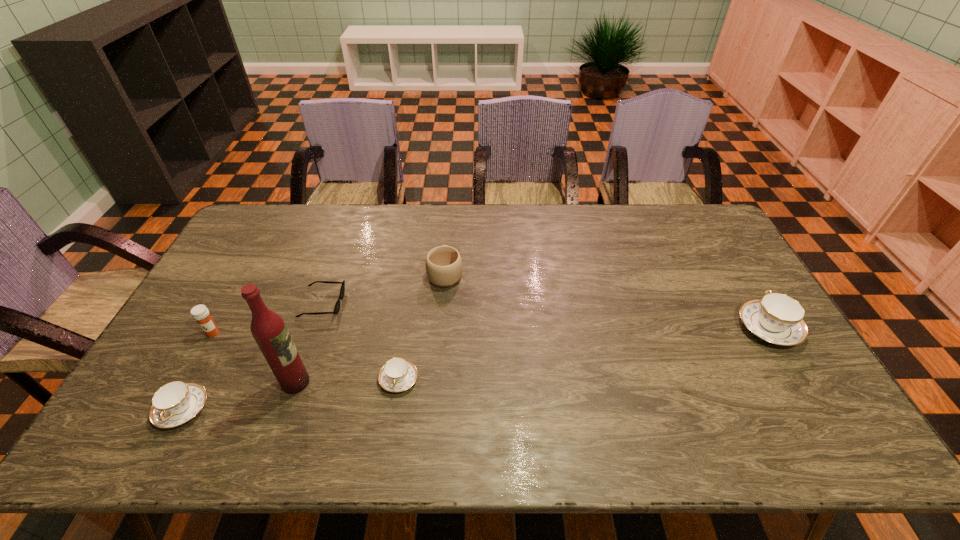
Where is `teacup that is the closest to the liquor`? This screenshot has height=540, width=960. teacup that is the closest to the liquor is located at coordinates click(x=175, y=403).

Point out which teacup is positioned as the nearest to the tallest object. Please provide its 2D coordinates. Your answer should be formatted as a tuple, i.e. [(x, y)], where the tuple contains the x and y coordinates of a point satisfying the conditions above.

[(175, 403)]

Locate an element on the screen. Image resolution: width=960 pixels, height=540 pixels. vacant region that satisfies the following two spatial constraints: 1. on the front-facing side of the sunglasses; 2. on the label side of the medicine is located at coordinates (312, 333).

Find the location of `vacant position in the image that satisfies the following two spatial constraints: 1. on the side with the handle of the tallest teacup; 2. on the front-facing side of the sunglasses`. vacant position in the image that satisfies the following two spatial constraints: 1. on the side with the handle of the tallest teacup; 2. on the front-facing side of the sunglasses is located at coordinates (754, 303).

Find the location of a particular element. The height and width of the screenshot is (540, 960). vacant space that satisfies the following two spatial constraints: 1. on the front-facing side of the shortest object; 2. on the label side of the medicine is located at coordinates click(x=312, y=333).